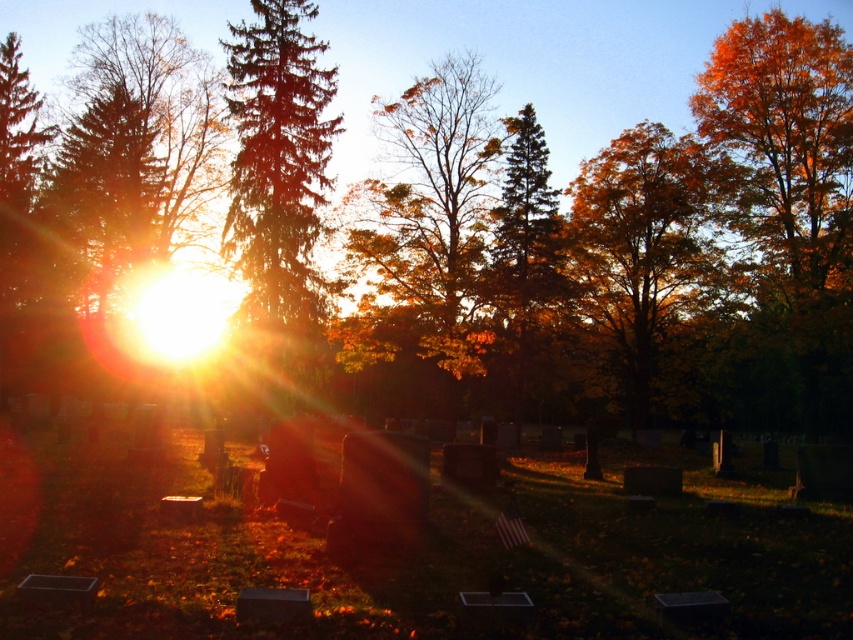
You are a photographer standing in the cemetery and want to capture a photo of the orange leafy tree at center without the autumn leaves at center blocking the view. Is this possible?

The autumn leaves at center are in front of the orange leafy tree at center, so they will block the view. To capture the tree without the leaves blocking it, you would need to move to a position where the autumn leaves at center are not between you and the orange leafy tree at center.

You are standing at the center of the cemetery and see autumn leaves at center. Can you confirm if the autumn leaves at center are exactly at the point with coordinates (426, 230)?

Yes, the autumn leaves at center are exactly located at the point with coordinates (426, 230).

You are standing in the cemetery and want to find the orange leafy tree at center. Which direction should you look to see the point at coordinates point [643,257]?

The point at coordinates point [643,257] is on the orange leafy tree at center, so you should look towards the center of the cemetery to see it.